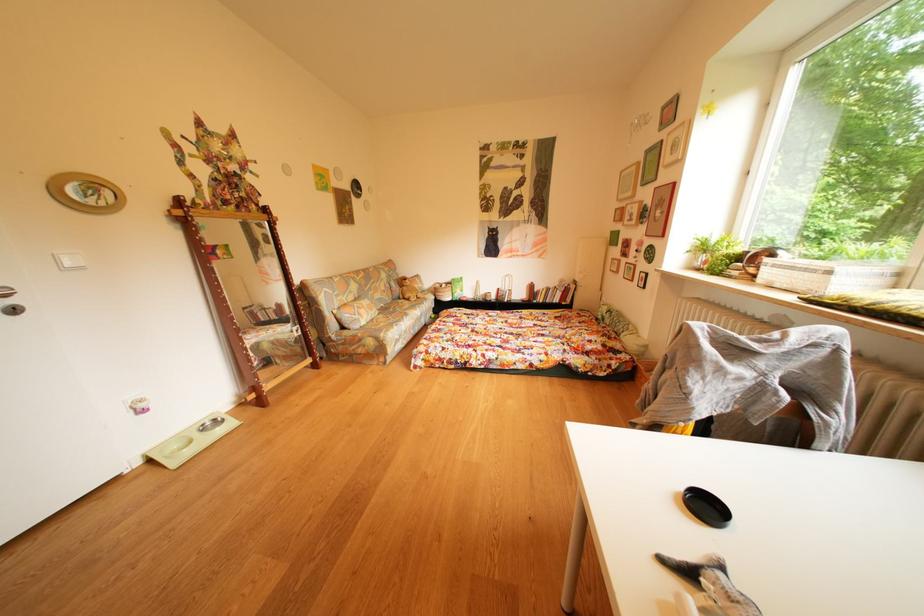
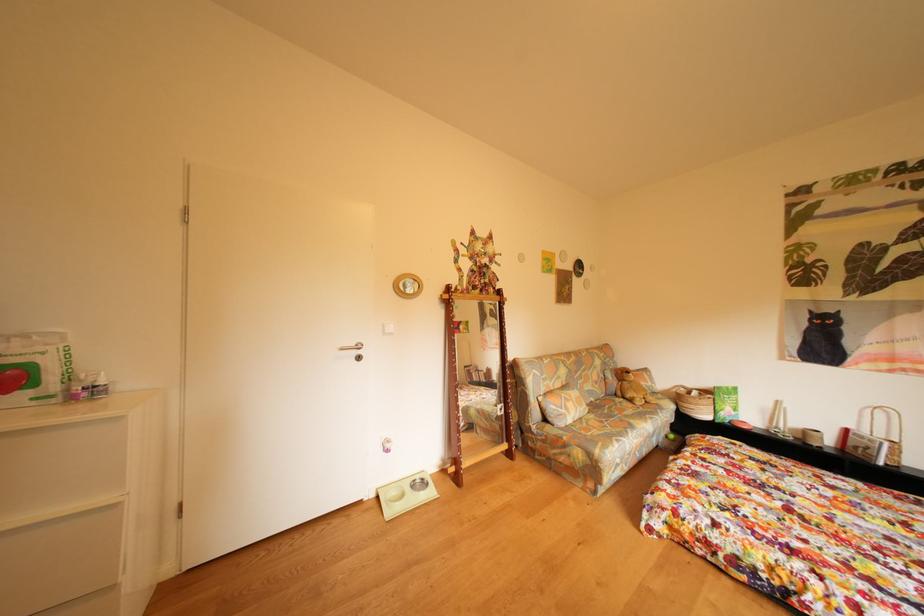
Question: The first image is from the beginning of the video and the second image is from the end. How did the camera likely rotate when shooting the video?

Choices:
 (A) Left
 (B) Right
 (C) Up
 (D) Down

Answer: (A)